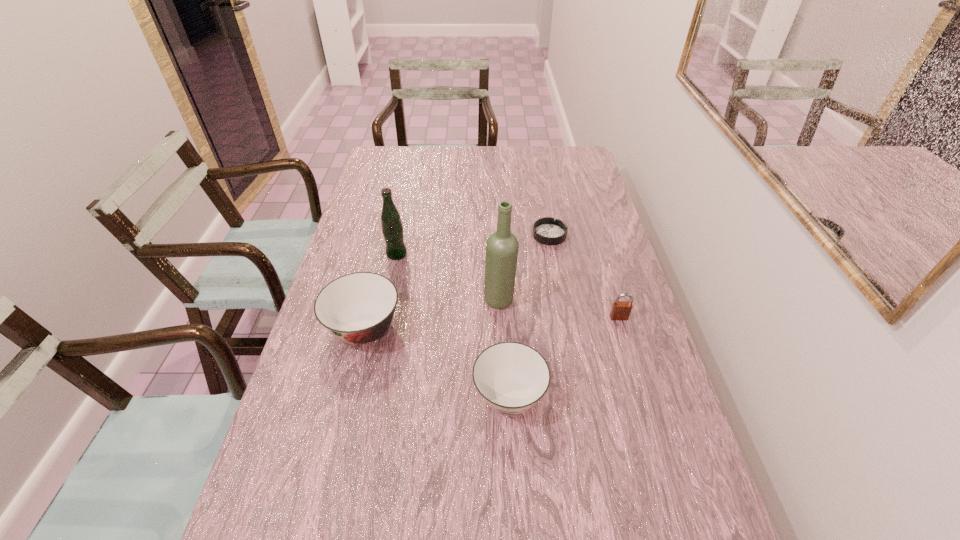
Where is `free space between the fifth object from left to right and the rightmost object`? This screenshot has width=960, height=540. free space between the fifth object from left to right and the rightmost object is located at coordinates (584, 276).

Where is `vacant space that is in between the tallest object and the third tallest object`? Image resolution: width=960 pixels, height=540 pixels. vacant space that is in between the tallest object and the third tallest object is located at coordinates (432, 315).

Where is `free space between the second farthest object and the tallest object`? The image size is (960, 540). free space between the second farthest object and the tallest object is located at coordinates (448, 277).

Where is `vacant space that is in between the fifth shortest object and the fifth object from left to right`? The image size is (960, 540). vacant space that is in between the fifth shortest object and the fifth object from left to right is located at coordinates (473, 245).

At what (x,y) coordinates should I click in order to perform the action: click on unoccupied position between the rightmost object and the third tallest object. Please return your answer as a coordinate pair (x, y). This screenshot has height=540, width=960. Looking at the image, I should click on (492, 323).

Identify the location of object that stands as the fourth closest to the third tallest object. Image resolution: width=960 pixels, height=540 pixels. (548, 231).

Locate an element on the screen. The width and height of the screenshot is (960, 540). object that is the third closest to the wine bottle is located at coordinates (357, 308).